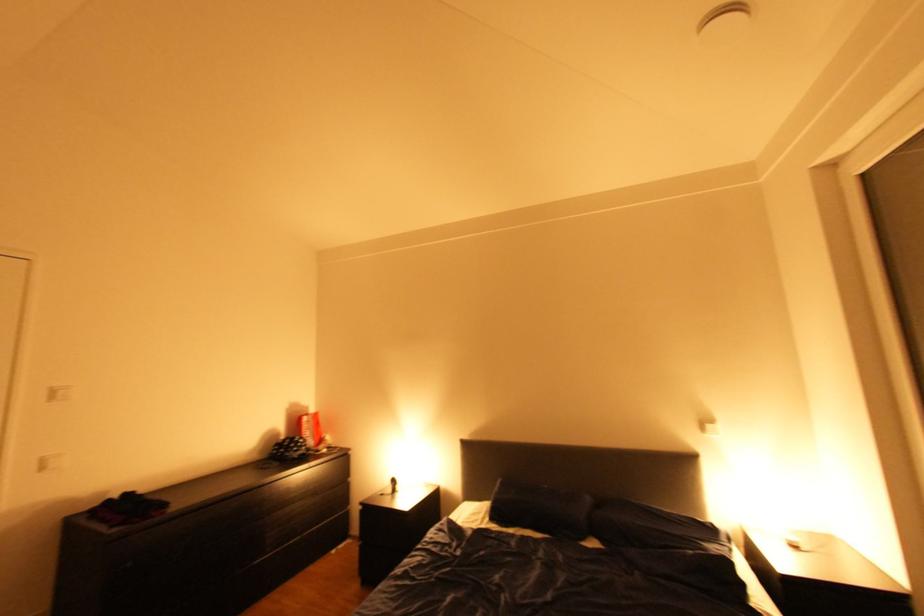
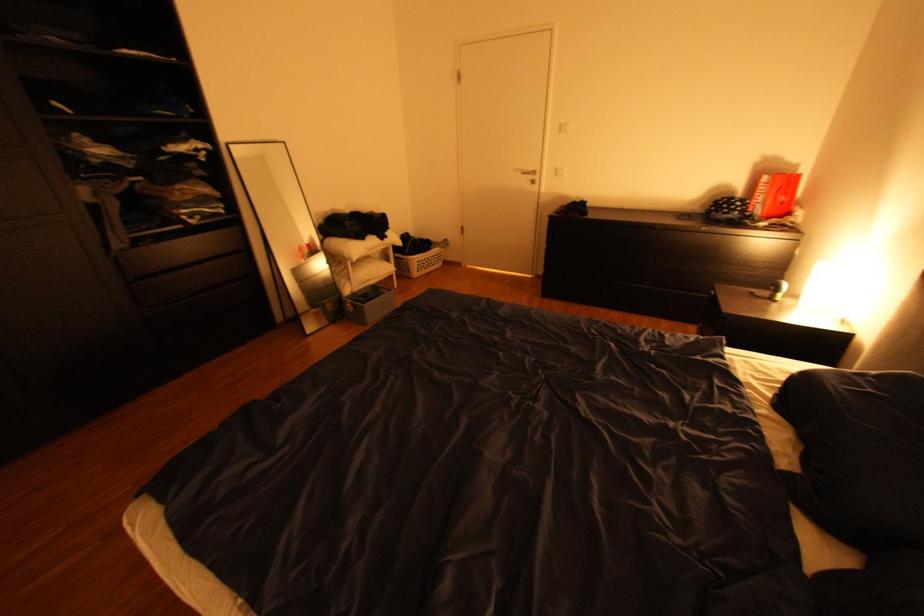
The point at (x=52, y=468) is marked in the first image. Where is the corresponding point in the second image?

(565, 174)